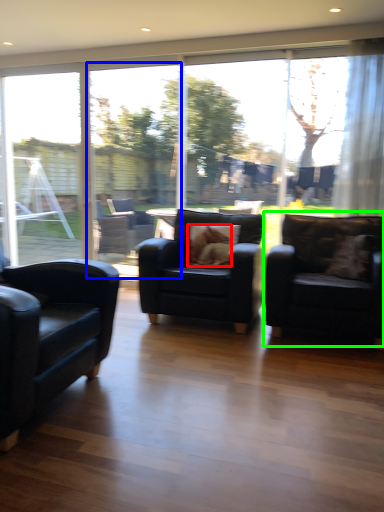
Question: Considering the real-world distances, which object is farthest from animal (highlighted by a red box)? screen door (highlighted by a blue box) or chair (highlighted by a green box)?

Choices:
 (A) screen door
 (B) chair

Answer: (A)